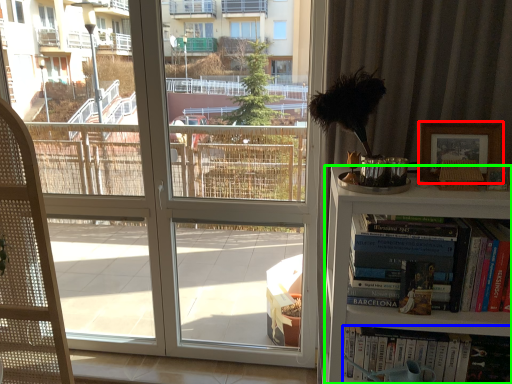
Question: Considering the real-world distances, which object is closest to picture frame (highlighted by a red box)? book (highlighted by a blue box) or bookcase (highlighted by a green box).

Choices:
 (A) book
 (B) bookcase

Answer: (B)